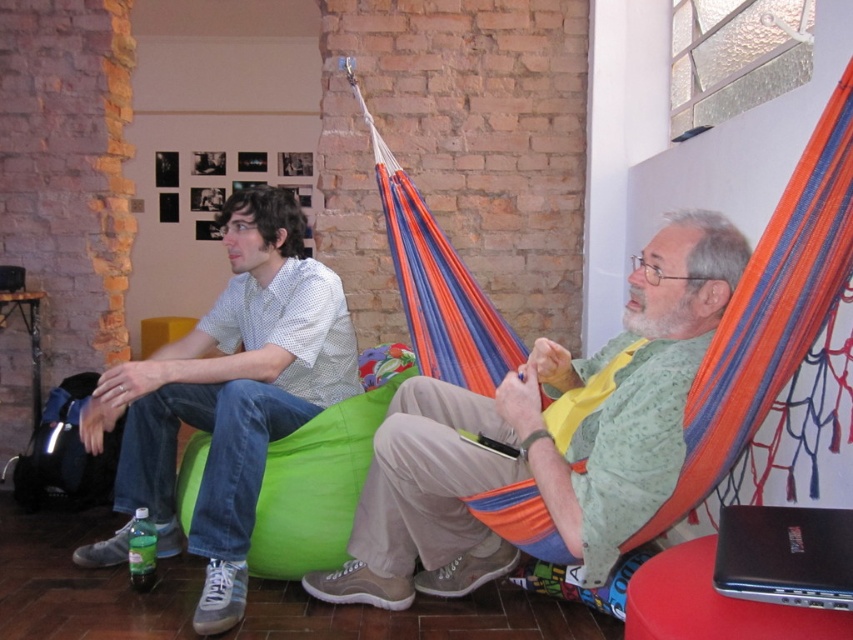
Where is `green fabric bean bag at lower left`? green fabric bean bag at lower left is located at coordinates (322, 474).

Who is positioned more to the right, green fabric bean bag at lower left or black plastic laptop at lower right?

black plastic laptop at lower right is more to the right.

What are the coordinates of `green fabric bean bag at lower left` in the screenshot? It's located at (322, 474).

Does matte white shirt at left lie in front of green fabric bean bag at lower left?

Yes, matte white shirt at left is in front of green fabric bean bag at lower left.

Where is `matte white shirt at left`? matte white shirt at left is located at coordinates (230, 392).

Can you confirm if green fabric hammock at center is taller than matte white shirt at left?

In fact, green fabric hammock at center may be shorter than matte white shirt at left.

Is the position of green fabric hammock at center less distant than that of matte white shirt at left?

Yes, it is in front of matte white shirt at left.

Locate an element on the screen. This screenshot has height=640, width=853. green fabric hammock at center is located at coordinates (543, 436).